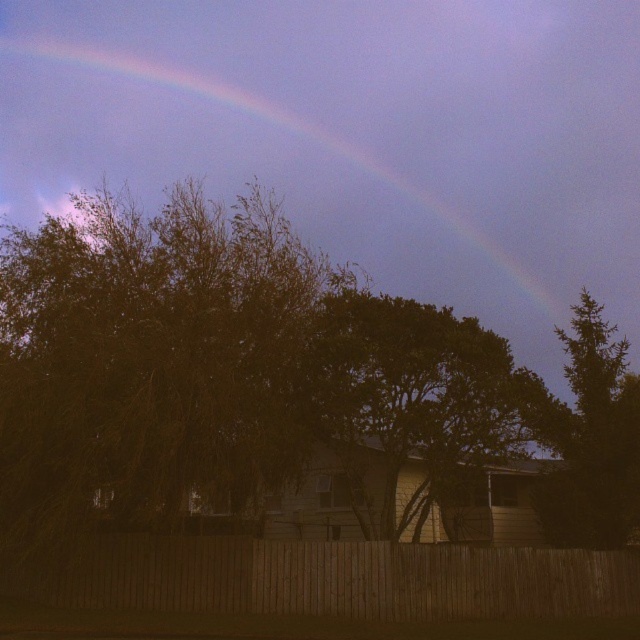
Question: Is wooden fence at lower center positioned behind green leafy tree at center?

Choices:
 (A) no
 (B) yes

Answer: (A)

Question: Based on their relative distances, which object is nearer to the green leafy tree at center?

Choices:
 (A) wooden fence at lower center
 (B) green leafy tree at upper right
 (C) rainbow at upper center

Answer: (B)

Question: Is rainbow at upper center smaller than green leafy tree at center?

Choices:
 (A) no
 (B) yes

Answer: (A)

Question: Is the position of wooden fence at lower center more distant than that of green leafy tree at center?

Choices:
 (A) yes
 (B) no

Answer: (B)

Question: Which object appears farthest from the camera in this image?

Choices:
 (A) wooden fence at lower center
 (B) green leafy tree at center

Answer: (B)

Question: Which object is the farthest from the rainbow at upper center?

Choices:
 (A) wooden fence at lower center
 (B) green leafy tree at center

Answer: (B)